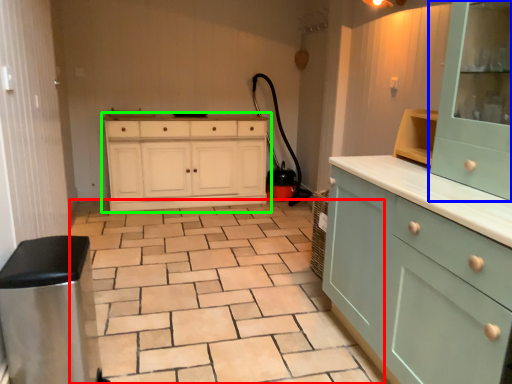
Question: Based on their relative distances, which object is farther from ceramic tile (highlighted by a red box)? Choose from cabinetry (highlighted by a blue box) and chest of drawers (highlighted by a green box).

Choices:
 (A) cabinetry
 (B) chest of drawers

Answer: (A)